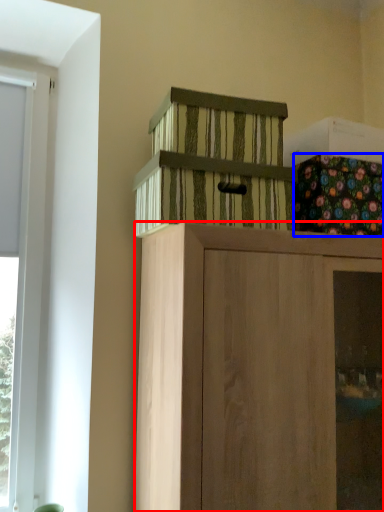
Question: Which of the following is the farthest to the observer, cabinetry (highlighted by a red box) or flower (highlighted by a blue box)?

Choices:
 (A) cabinetry
 (B) flower

Answer: (B)